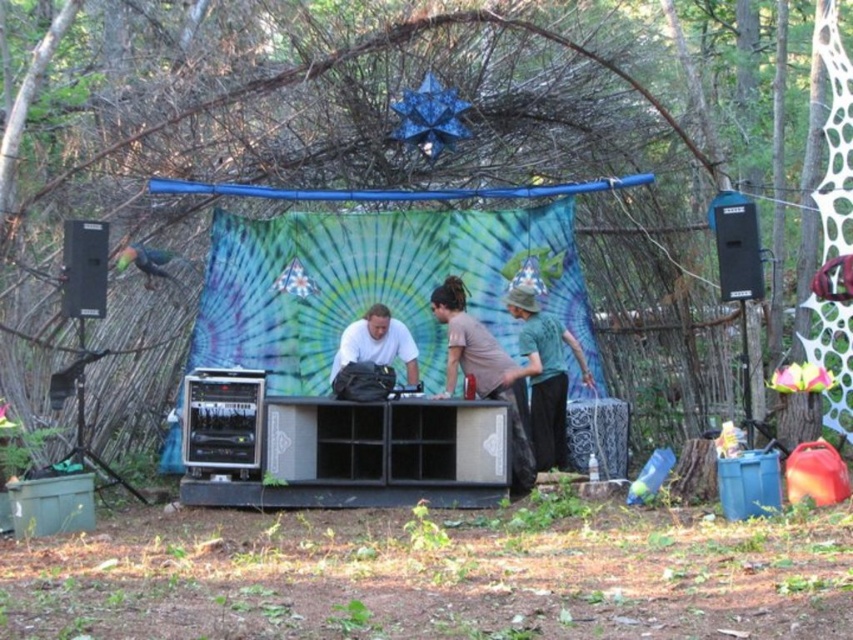
Question: Considering the relative positions of green cotton shirt at center and white matte shirt at center in the image provided, where is green cotton shirt at center located with respect to white matte shirt at center?

Choices:
 (A) left
 (B) right

Answer: (B)

Question: Which object appears farthest from the camera in this image?

Choices:
 (A) white matte shirt at center
 (B) green cotton shirt at center
 (C) tie-dye fabric tent at center

Answer: (C)

Question: Is tie-dye fabric tent at center to the right of green cotton shirt at center from the viewer's perspective?

Choices:
 (A) yes
 (B) no

Answer: (B)

Question: Where is tie-dye fabric tent at center located in relation to green cotton shirt at center in the image?

Choices:
 (A) above
 (B) below

Answer: (A)

Question: Which object is the farthest from the tie-dye fabric tent at center?

Choices:
 (A) green cotton shirt at center
 (B) white matte shirt at center

Answer: (A)

Question: Estimate the real-world distances between objects in this image. Which object is closer to the green cotton shirt at center?

Choices:
 (A) white matte shirt at center
 (B) tie-dye fabric tent at center

Answer: (B)